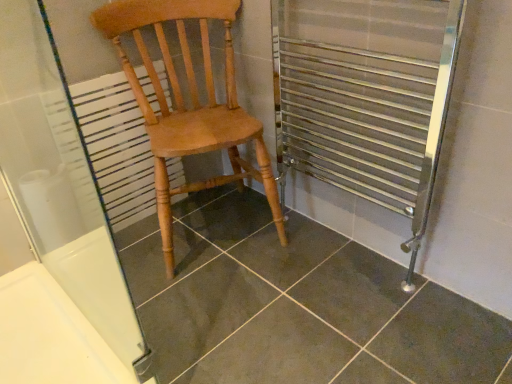
Locate an element on the screen. vacant area that is in front of light brown wood chair at center is located at coordinates (205, 312).